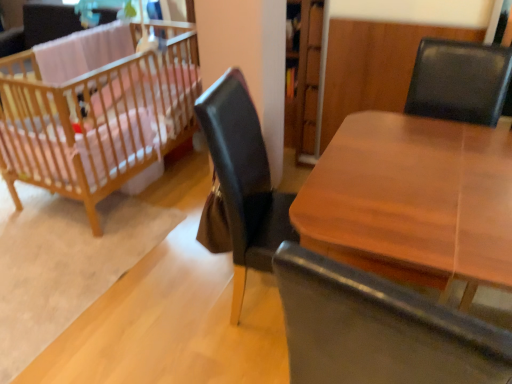
Question: Is wooden crib at left taller than wooden table at center?

Choices:
 (A) yes
 (B) no

Answer: (A)

Question: Are wooden crib at left and wooden table at center making contact?

Choices:
 (A) no
 (B) yes

Answer: (A)

Question: Is wooden table at center surrounded by wooden crib at left?

Choices:
 (A) no
 (B) yes

Answer: (A)

Question: From the image's perspective, would you say wooden crib at left is positioned over wooden table at center?

Choices:
 (A) no
 (B) yes

Answer: (B)

Question: From a real-world perspective, is wooden crib at left positioned over wooden table at center based on gravity?

Choices:
 (A) no
 (B) yes

Answer: (B)

Question: Is the depth of wooden crib at left less than that of wooden table at center?

Choices:
 (A) yes
 (B) no

Answer: (B)

Question: Does wooden table at center have a greater height compared to wooden crib at left?

Choices:
 (A) yes
 (B) no

Answer: (B)

Question: Can you confirm if wooden table at center is bigger than wooden crib at left?

Choices:
 (A) yes
 (B) no

Answer: (B)

Question: From the image's perspective, does wooden table at center appear lower than wooden crib at left?

Choices:
 (A) no
 (B) yes

Answer: (B)

Question: From the image's perspective, does wooden table at center appear higher than wooden crib at left?

Choices:
 (A) yes
 (B) no

Answer: (B)

Question: Is wooden table at center further to camera compared to wooden crib at left?

Choices:
 (A) yes
 (B) no

Answer: (B)

Question: Would you say wooden table at center contains wooden crib at left?

Choices:
 (A) no
 (B) yes

Answer: (A)

Question: In terms of width, does wooden table at center look wider or thinner when compared to wooden crib at left?

Choices:
 (A) thin
 (B) wide

Answer: (A)